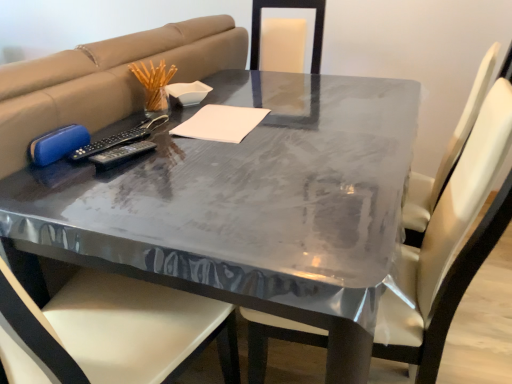
Locate an element on the screen. vacant space to the right of white paper at center is located at coordinates (303, 123).